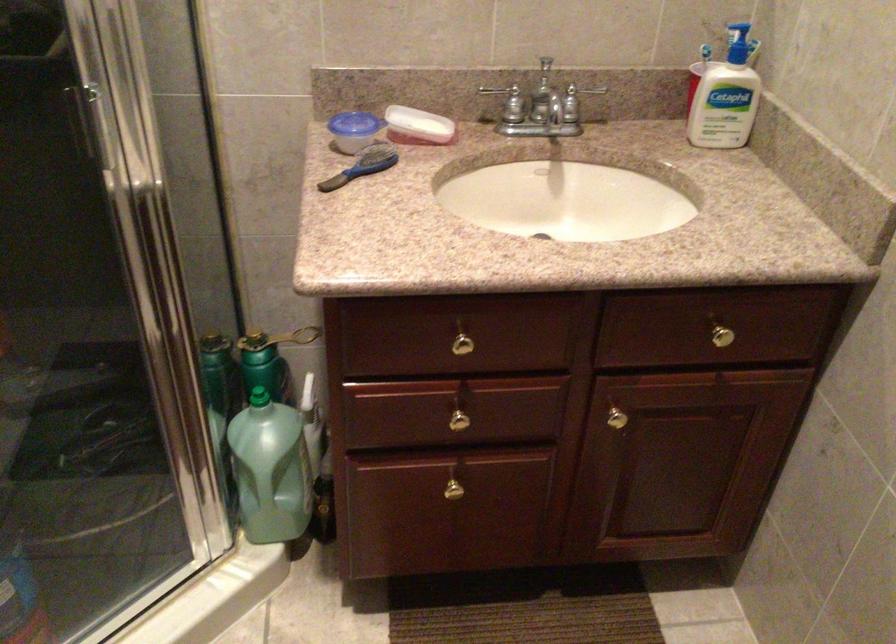
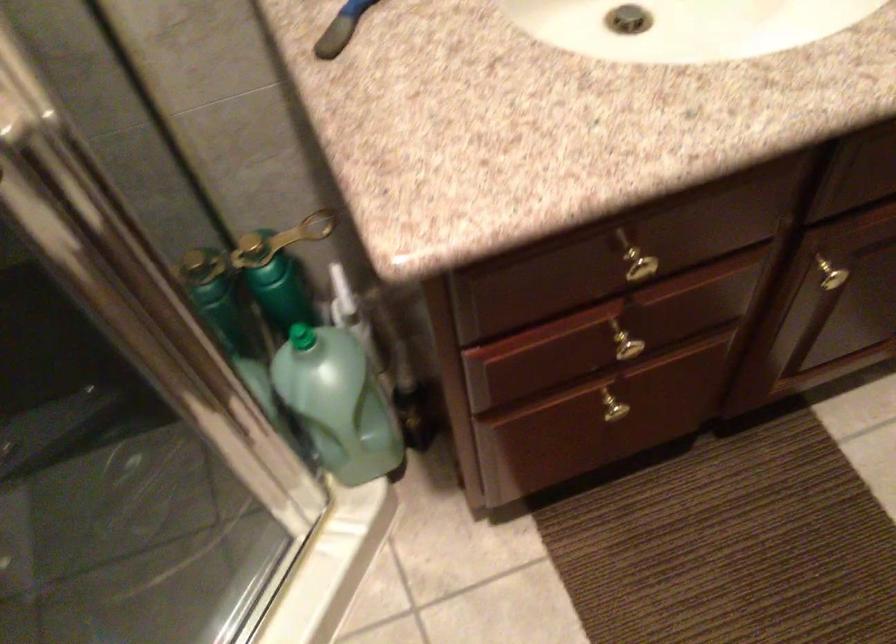
Find the pixel in the second image that matches the point at 264,453 in the first image.

(338, 402)